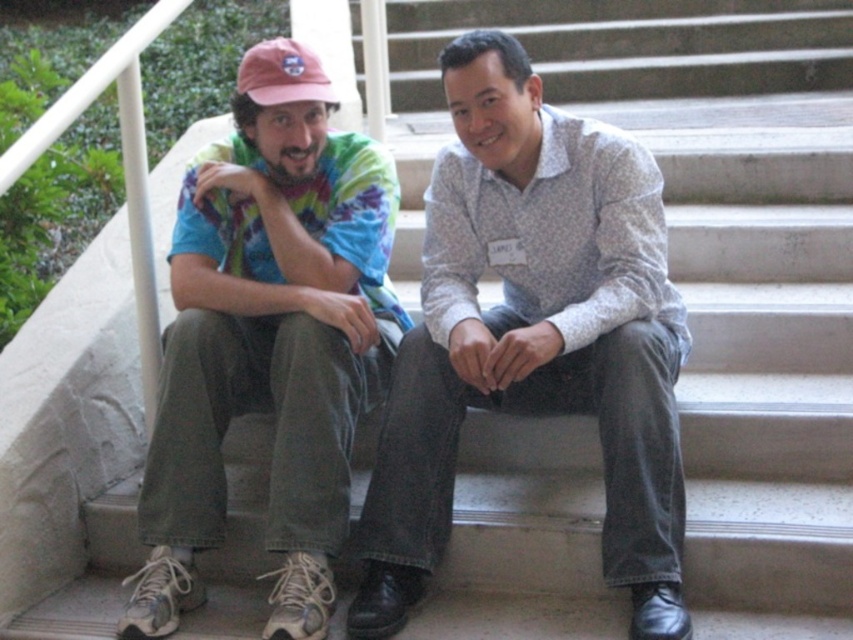
Question: Can you confirm if white textured shirt at center is wider than tie-dye fabric shirt at left?

Choices:
 (A) yes
 (B) no

Answer: (A)

Question: Which point is farther to the camera?

Choices:
 (A) tie-dye fabric shirt at left
 (B) pink fabric baseball cap at upper left

Answer: (B)

Question: Among these objects, which one is farthest from the camera?

Choices:
 (A) pink fabric baseball cap at upper left
 (B) white textured shirt at center

Answer: (A)

Question: Does white textured shirt at center appear over pink fabric baseball cap at upper left?

Choices:
 (A) yes
 (B) no

Answer: (B)

Question: Can you confirm if white textured shirt at center is thinner than tie-dye fabric shirt at left?

Choices:
 (A) no
 (B) yes

Answer: (A)

Question: Which is nearer to the tie-dye fabric shirt at left?

Choices:
 (A) pink fabric baseball cap at upper left
 (B) white textured shirt at center

Answer: (B)